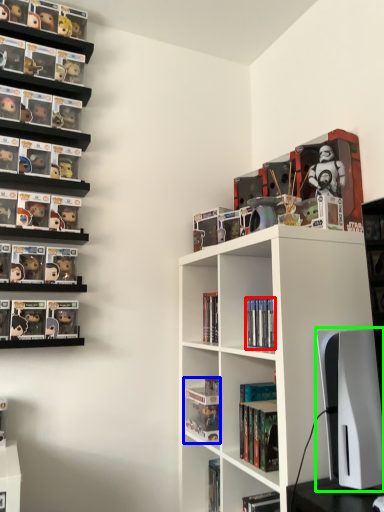
Question: Based on their relative distances, which object is nearer to book (highlighted by a red box)? Choose from book (highlighted by a blue box) and computer monitor (highlighted by a green box).

Choices:
 (A) book
 (B) computer monitor

Answer: (B)